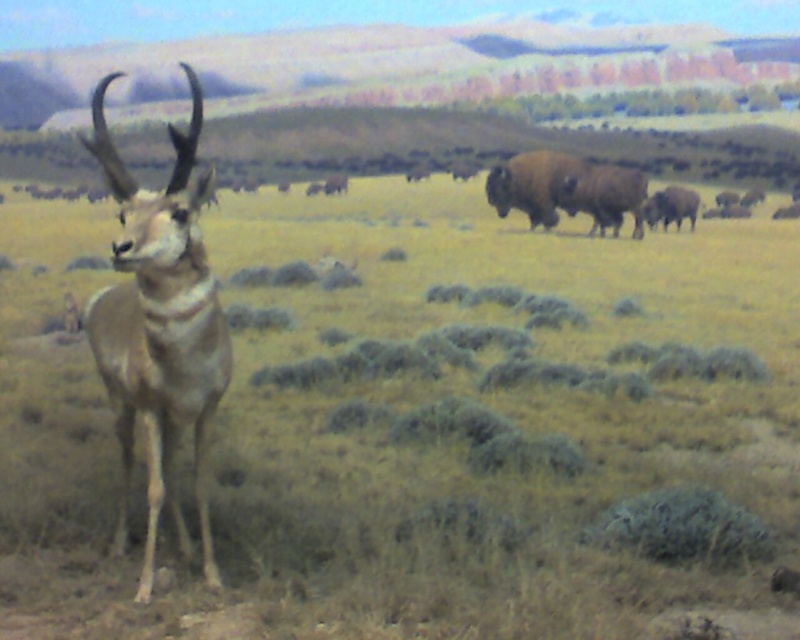
Does green grassy at center come behind brown furry yak at right?

That is False.

I want to click on green grassy at center, so click(424, 429).

Who is more distant from viewer, (256, 250) or (568, 156)?

The point (568, 156) is behind.

Where is `green grassy at center`? The height and width of the screenshot is (640, 800). green grassy at center is located at coordinates (424, 429).

Between brown furry yak at right and brown textured bison at center-right, which one appears on the left side from the viewer's perspective?

brown furry yak at right is more to the left.

Which is in front, point (605, 200) or point (649, 218)?

Positioned in front is point (605, 200).

Find the location of `brown furry yak at right`. brown furry yak at right is located at coordinates (566, 189).

Which is more to the left, light brown fur antelope at left or brown furry yak at right?

Positioned to the left is light brown fur antelope at left.

This screenshot has width=800, height=640. I want to click on light brown fur antelope at left, so click(x=158, y=323).

Locate an element on the screen. The width and height of the screenshot is (800, 640). light brown fur antelope at left is located at coordinates (158, 323).

Identify the location of light brown fur antelope at left. Image resolution: width=800 pixels, height=640 pixels. (158, 323).